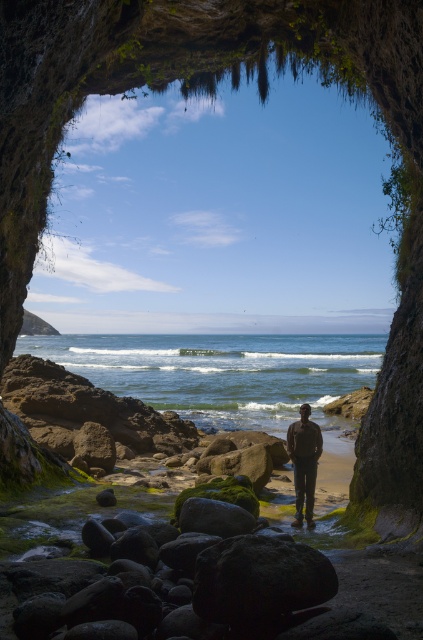
Can you confirm if dark matte rock at center is bigger than dark brown leather jacket at center?

Incorrect, dark matte rock at center is not larger than dark brown leather jacket at center.

Is dark matte rock at center thinner than dark brown leather jacket at center?

No.

Does point (255, 548) come closer to viewer compared to point (321, 440)?

Yes, point (255, 548) is in front of point (321, 440).

Image resolution: width=423 pixels, height=640 pixels. I want to click on dark matte rock at center, so click(258, 580).